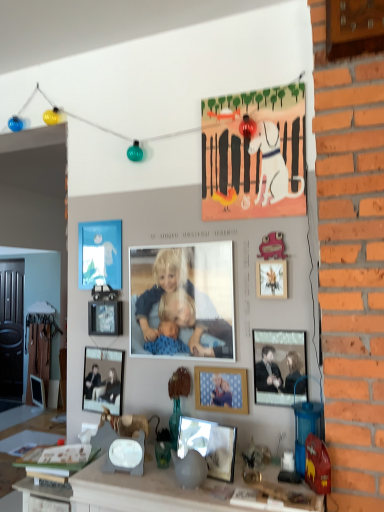
Question: Can you confirm if pink matte picture frame at upper right, marked as the second picture frame in a top-to-bottom arrangement, is taller than metallic silver picture frame at center-left, marked as the sixth picture frame in a bottom-to-top arrangement?

Choices:
 (A) yes
 (B) no

Answer: (A)

Question: Is pink matte picture frame at upper right, which is the 6th picture frame in back-to-front order, positioned behind metallic silver picture frame at center-left, which appears as the fifth picture frame when viewed from the right?

Choices:
 (A) no
 (B) yes

Answer: (A)

Question: Does pink matte picture frame at upper right, which appears as the 3th picture frame when viewed from the front, appear on the left side of metallic silver picture frame at center-left, which is the 3th picture frame from top to bottom?

Choices:
 (A) no
 (B) yes

Answer: (A)

Question: From the image's perspective, does pink matte picture frame at upper right, which is the 6th picture frame in back-to-front order, appear lower than metallic silver picture frame at center-left, marked as the 4th picture frame in a left-to-right arrangement?

Choices:
 (A) yes
 (B) no

Answer: (B)

Question: Can metallic silver picture frame at center-left, marked as the 4th picture frame in a left-to-right arrangement, be found inside pink matte picture frame at upper right, which is the 7th picture frame in left-to-right order?

Choices:
 (A) no
 (B) yes

Answer: (A)

Question: Considering the positions of smooth gray stone counter at center and blue matte picture frame at upper left, which ranks as the seventh picture frame in right-to-left order, in the image, is smooth gray stone counter at center wider or thinner than blue matte picture frame at upper left, which ranks as the seventh picture frame in right-to-left order,?

Choices:
 (A) thin
 (B) wide

Answer: (B)

Question: Considering the positions of smooth gray stone counter at center and blue matte picture frame at upper left, the 2th picture frame viewed from the left, in the image, is smooth gray stone counter at center bigger or smaller than blue matte picture frame at upper left, the 2th picture frame viewed from the left,?

Choices:
 (A) small
 (B) big

Answer: (B)

Question: Would you say smooth gray stone counter at center is to the left or to the right of blue matte picture frame at upper left, which is the seventh picture frame in front-to-back order, in the picture?

Choices:
 (A) left
 (B) right

Answer: (B)

Question: Choose the correct answer: Is smooth gray stone counter at center inside blue matte picture frame at upper left, the 2th picture frame viewed from the left, or outside it?

Choices:
 (A) inside
 (B) outside

Answer: (B)

Question: From the image's perspective, is smooth gray stone counter at center positioned above or below matte black picture frame at center-right, the second picture frame when ordered from front to back?

Choices:
 (A) below
 (B) above

Answer: (A)

Question: Is point (132, 497) positioned closer to the camera than point (299, 359)?

Choices:
 (A) closer
 (B) farther

Answer: (A)

Question: Is smooth gray stone counter at center taller or shorter than matte black picture frame at center-right, the second picture frame when ordered from front to back?

Choices:
 (A) tall
 (B) short

Answer: (A)

Question: Is smooth gray stone counter at center to the left or to the right of matte black picture frame at center-right, acting as the 1th picture frame starting from the right, in the image?

Choices:
 (A) right
 (B) left

Answer: (B)

Question: Is wooden photo frame at center, the fourth picture frame in the front-to-back sequence, situated inside matte black picture frame at center, which is counted as the 6th picture frame, starting from the top, or outside?

Choices:
 (A) inside
 (B) outside

Answer: (B)

Question: From the image's perspective, is wooden photo frame at center, the fourth picture frame in the front-to-back sequence, located above or below matte black picture frame at center, which is counted as the 6th picture frame, starting from the top?

Choices:
 (A) above
 (B) below

Answer: (A)